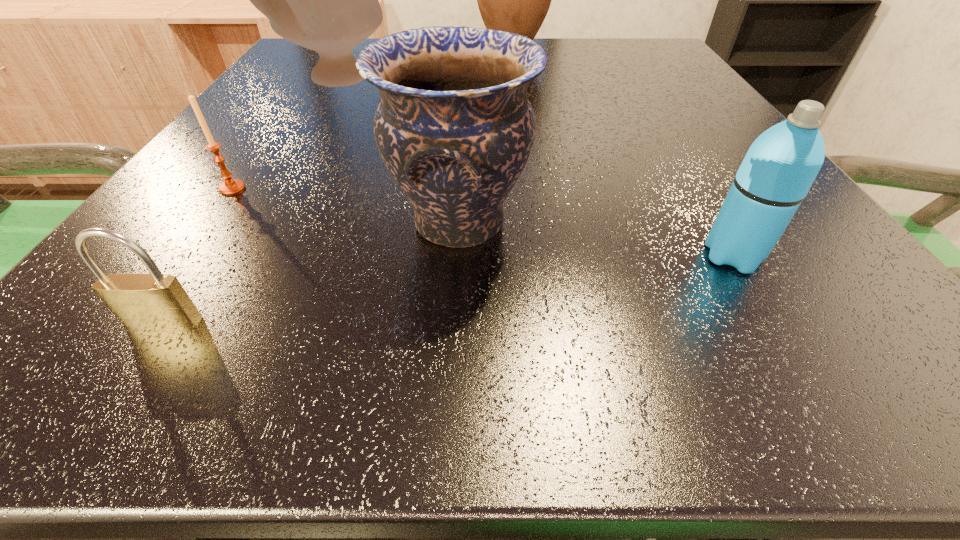
Identify the location of object positioned at the far left corner. This screenshot has width=960, height=540. (326, 0).

Where is `object present at the near left corner`? object present at the near left corner is located at coordinates (153, 301).

In the image, there is a desktop. Where is `vacant space at the far edge`? Image resolution: width=960 pixels, height=540 pixels. vacant space at the far edge is located at coordinates (577, 55).

Find the location of a particular element. This screenshot has width=960, height=540. vacant space at the near edge of the desktop is located at coordinates (575, 354).

Locate an element on the screen. This screenshot has height=540, width=960. free space at the left edge of the desktop is located at coordinates (174, 226).

Identify the location of vacant space at the far left corner of the desktop. This screenshot has height=540, width=960. (299, 50).

Identify the location of vacant space at the far right corner. This screenshot has width=960, height=540. (588, 39).

Identify the location of free space at the near right corner of the desktop. (865, 366).

Locate an element on the screen. free space between the candle_holder and the farther pottery is located at coordinates (284, 134).

You are a GUI agent. You are given a task and a screenshot of the screen. Output one action in this format:
    pyautogui.click(x=<x>, y=<y>)
    Task: Click on the free space between the right pottery and the candle_holder
    
    Given the screenshot: What is the action you would take?
    pyautogui.click(x=346, y=206)